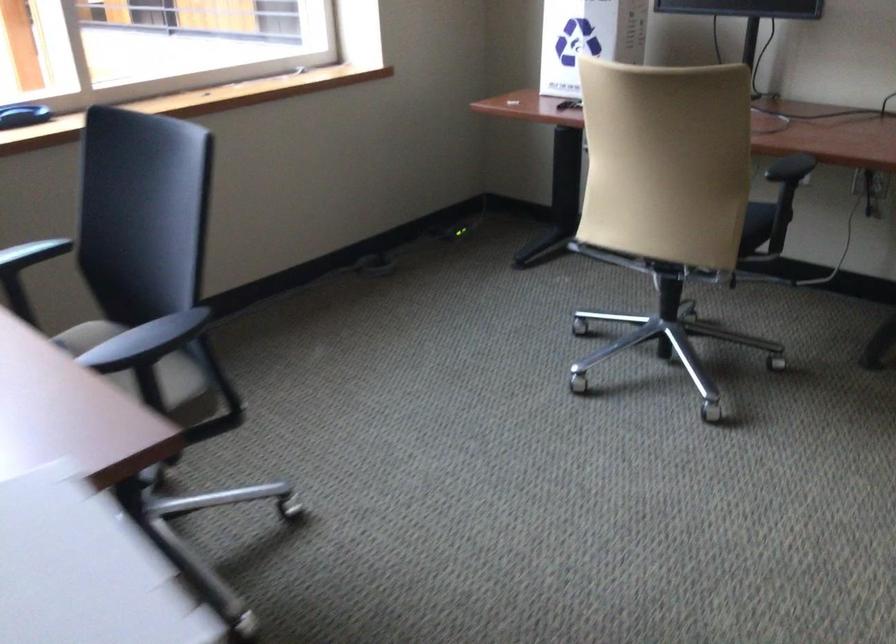
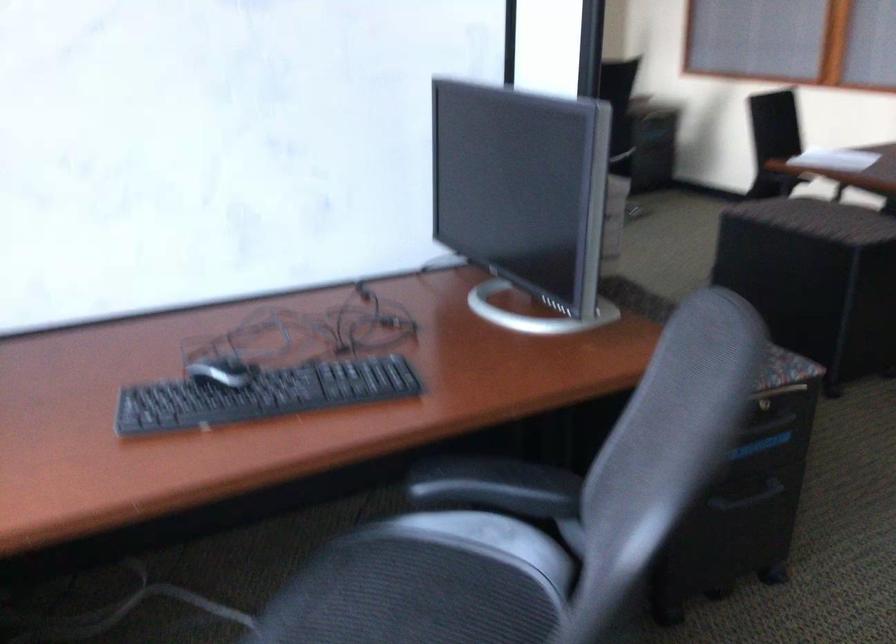
Question: I am providing you with two images of the same scene from different viewpoints. After the viewpoint changes to image2, which objects are now occluded?

Choices:
 (A) cabinet drawer handle
 (B) black toy vehicle
 (C) beige chair sitting surface
 (D) black chair armrest

Answer: (C)